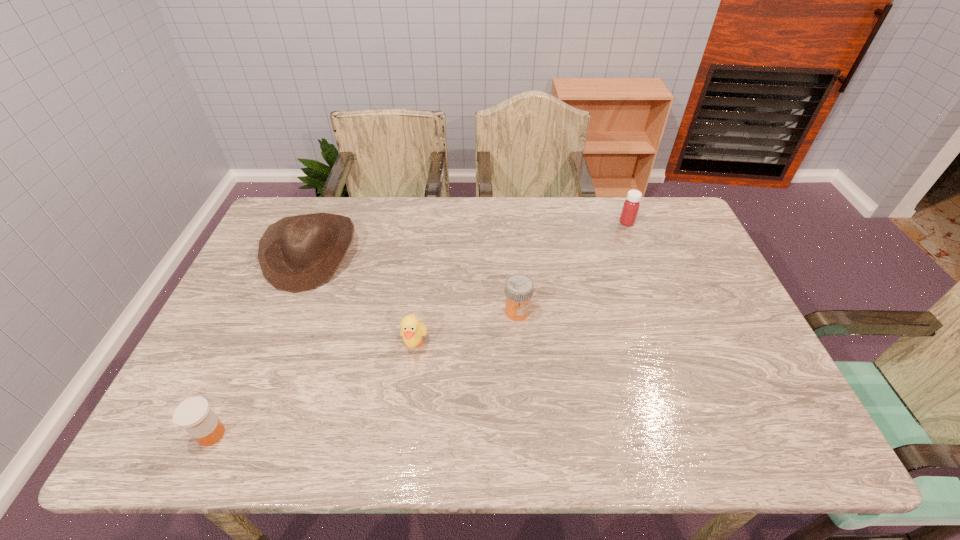
I want to click on object at the near left corner, so click(x=194, y=414).

You are a GUI agent. You are given a task and a screenshot of the screen. Output one action in this format:
    pyautogui.click(x=<x>, y=<y>)
    Task: Click on the vacant space at the far edge of the desktop
    
    Given the screenshot: What is the action you would take?
    pyautogui.click(x=624, y=232)

This screenshot has width=960, height=540. What are the coordinates of `vacant space at the near edge of the desktop` in the screenshot? It's located at (255, 431).

The height and width of the screenshot is (540, 960). I want to click on free spot at the left edge of the desktop, so click(x=247, y=307).

Identify the location of vacant area at the far left corner. Image resolution: width=960 pixels, height=540 pixels. (309, 207).

Identify the location of free space at the far right corner. The width and height of the screenshot is (960, 540). (688, 228).

Where is `empty space that is in between the cowboy hat and the third object from left to right`? The height and width of the screenshot is (540, 960). empty space that is in between the cowboy hat and the third object from left to right is located at coordinates (363, 299).

Locate an element on the screen. This screenshot has height=540, width=960. vacant area that lies between the cowboy hat and the rightmost object is located at coordinates (468, 238).

Identify the location of free spot between the second medicine from right to left and the third object from left to right. The height and width of the screenshot is (540, 960). (466, 328).

At what (x,y) coordinates should I click in order to perform the action: click on free space between the third nearest object and the cowboy hat. Please return your answer as a coordinate pair (x, y). The height and width of the screenshot is (540, 960). Looking at the image, I should click on (414, 282).